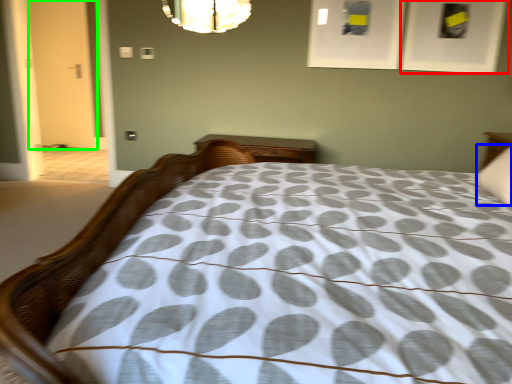
Question: Which object is positioned farthest from picture frame (highlighted by a red box)? Select from pillow (highlighted by a blue box) and door (highlighted by a green box).

Choices:
 (A) pillow
 (B) door

Answer: (B)